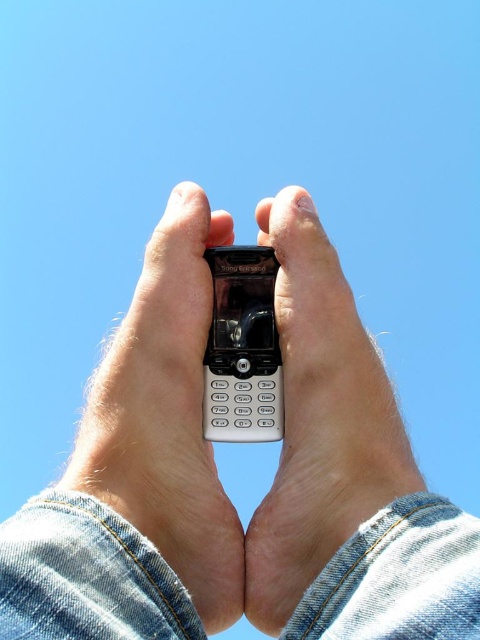
Is point (233, 596) farther from viewer compared to point (247, 428)?

No.

What do you see at coordinates (218, 481) in the screenshot? This screenshot has width=480, height=640. I see `white plastic phone at center` at bounding box center [218, 481].

The image size is (480, 640). What do you see at coordinates (218, 481) in the screenshot?
I see `white plastic phone at center` at bounding box center [218, 481].

Locate an element on the screen. white plastic phone at center is located at coordinates (218, 481).